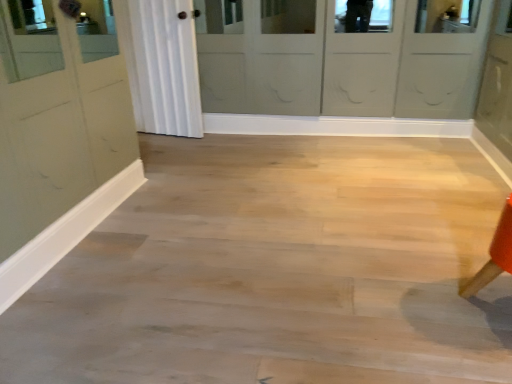
Where is `free spot above white smooth baseboard at lower left (from a real-world perspective)`? free spot above white smooth baseboard at lower left (from a real-world perspective) is located at coordinates [x=76, y=204].